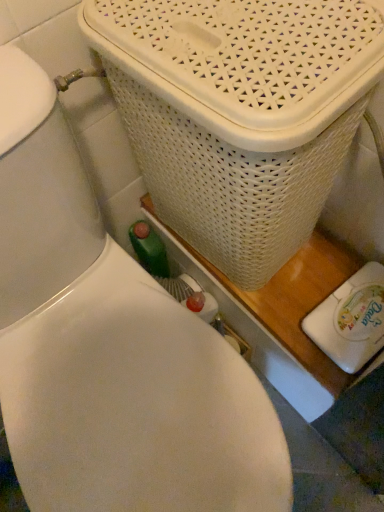
The height and width of the screenshot is (512, 384). Identify the location of free space above white woven basket at upper right (from a real-world perspective). (254, 33).